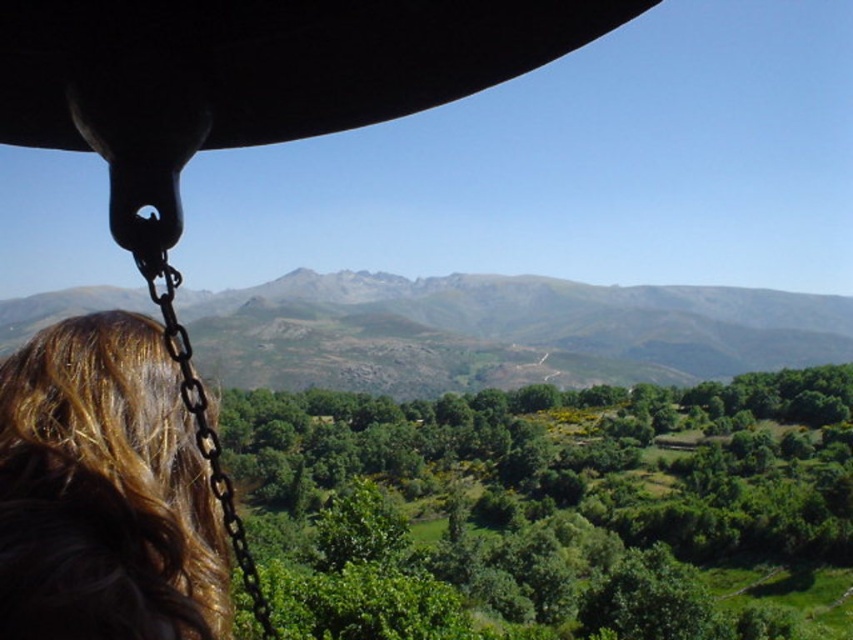
Question: Which of the following is the closest to the observer?

Choices:
 (A) pyautogui.click(x=392, y=289)
 (B) pyautogui.click(x=125, y=486)

Answer: (B)

Question: Observing the image, what is the correct spatial positioning of rugged stone mountain at center in reference to brown wavy hair at lower left?

Choices:
 (A) left
 (B) right

Answer: (B)

Question: Does rugged stone mountain at center appear over brown wavy hair at lower left?

Choices:
 (A) yes
 (B) no

Answer: (B)

Question: Which of the following is the farthest from the observer?

Choices:
 (A) brown wavy hair at lower left
 (B) rugged stone mountain at center

Answer: (B)

Question: Does rugged stone mountain at center appear on the right side of brown wavy hair at lower left?

Choices:
 (A) yes
 (B) no

Answer: (A)